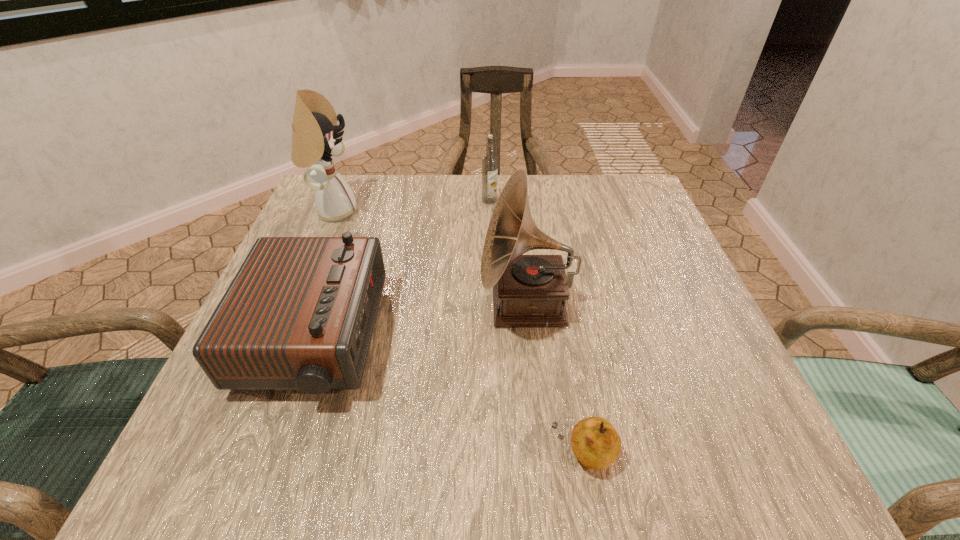
This screenshot has width=960, height=540. Identify the location of unoccupied position between the doll and the phonograph record. (430, 258).

This screenshot has width=960, height=540. In order to click on free point between the radio receiver and the pear in this screenshot , I will do `click(449, 397)`.

Find the location of `free space between the third tallest object and the doll`. free space between the third tallest object and the doll is located at coordinates point(411,206).

The image size is (960, 540). I want to click on the second closest object relative to the doll, so click(x=489, y=162).

Locate an element on the screen. the closest object to the nearest object is located at coordinates (528, 290).

Locate an element on the screen. The image size is (960, 540). vacant area that satisfies the following two spatial constraints: 1. on the label of the vodka; 2. on the tuning display of the radio receiver is located at coordinates (493, 340).

Find the location of a particular element. vacant point that satisfies the following two spatial constraints: 1. on the label of the third shortest object; 2. at the front face of the doll is located at coordinates [490, 211].

Identify the location of vacant space that satisfies the following two spatial constraints: 1. on the label of the vodka; 2. on the left side of the pear. The height and width of the screenshot is (540, 960). (496, 454).

What are the coordinates of `blank space that satisfies the following two spatial constraints: 1. on the horn of the phonograph record; 2. on the left side of the pear` in the screenshot? It's located at (542, 454).